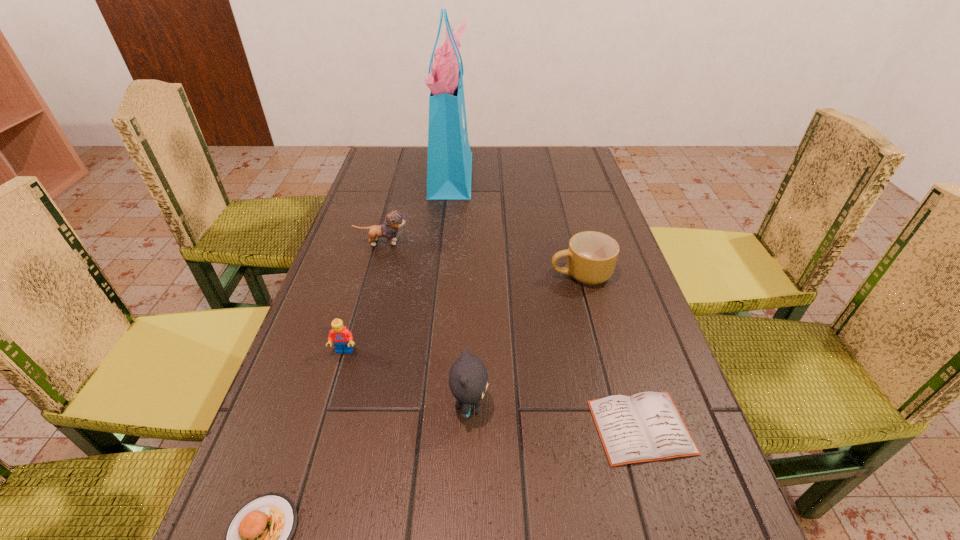
Locate an element on the screen. This screenshot has width=960, height=540. object that is the sixth nearest to the tallest object is located at coordinates (258, 539).

Locate an element on the screen. The image size is (960, 540). object identified as the second closest to the second farthest object is located at coordinates (342, 338).

Find the location of a particular element. This screenshot has height=540, width=960. vacant space that satisfies the following two spatial constraints: 1. on the front-facing side of the shortest object; 2. on the left side of the shorter kitten is located at coordinates (331, 427).

At what (x,y) coordinates should I click in order to perform the action: click on free space that satisfies the following two spatial constraints: 1. on the back side of the shortest object; 2. on the front-facing side of the right kitten. Please return your answer as a coordinate pair (x, y). The image size is (960, 540). Looking at the image, I should click on (635, 406).

The width and height of the screenshot is (960, 540). In order to click on free region that satisfies the following two spatial constraints: 1. on the side with the handle of the mug; 2. on the front-facing side of the shorter kitten in this screenshot , I will do tap(572, 243).

At what (x,y) coordinates should I click in order to perform the action: click on free space that satisfies the following two spatial constraints: 1. on the side with the handle of the mug; 2. on the front-facing side of the shorter kitten. Please return your answer as a coordinate pair (x, y). Looking at the image, I should click on (572, 243).